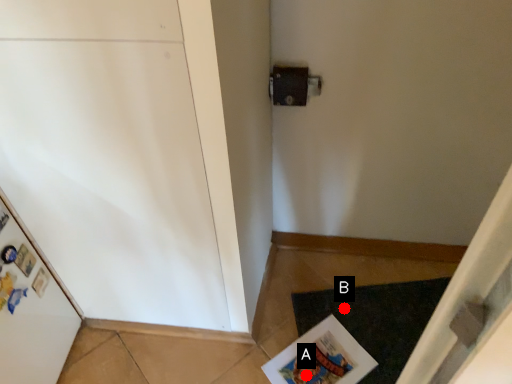
Question: Two points are circled on the image, labeled by A and B beside each circle. Which point is closer to the camera taking this photo?

Choices:
 (A) A is closer
 (B) B is closer

Answer: (A)